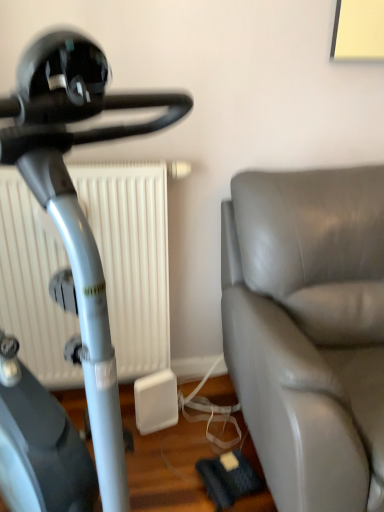
Question: Considering the relative sizes of gray leather couch at right and matte black stationary bicycle at left in the image provided, is gray leather couch at right taller than matte black stationary bicycle at left?

Choices:
 (A) yes
 (B) no

Answer: (B)

Question: Is gray leather couch at right touching matte black stationary bicycle at left?

Choices:
 (A) no
 (B) yes

Answer: (A)

Question: From a real-world perspective, is gray leather couch at right beneath matte black stationary bicycle at left?

Choices:
 (A) yes
 (B) no

Answer: (A)

Question: Can you confirm if gray leather couch at right is smaller than matte black stationary bicycle at left?

Choices:
 (A) no
 (B) yes

Answer: (A)

Question: Can you confirm if gray leather couch at right is bigger than matte black stationary bicycle at left?

Choices:
 (A) yes
 (B) no

Answer: (A)

Question: Can you confirm if gray leather couch at right is shorter than matte black stationary bicycle at left?

Choices:
 (A) yes
 (B) no

Answer: (A)

Question: Is gray leather couch at right at the right side of white matte radiator at center?

Choices:
 (A) no
 (B) yes

Answer: (B)

Question: Is gray leather couch at right closer to camera compared to white matte radiator at center?

Choices:
 (A) no
 (B) yes

Answer: (B)

Question: Can you confirm if gray leather couch at right is shorter than white matte radiator at center?

Choices:
 (A) yes
 (B) no

Answer: (B)

Question: From the image's perspective, is gray leather couch at right under white matte radiator at center?

Choices:
 (A) yes
 (B) no

Answer: (A)

Question: Is gray leather couch at right at the left side of white matte radiator at center?

Choices:
 (A) no
 (B) yes

Answer: (A)

Question: Is there a large distance between gray leather couch at right and white matte radiator at center?

Choices:
 (A) yes
 (B) no

Answer: (B)

Question: Does matte black stationary bicycle at left have a greater height compared to white matte radiator at center?

Choices:
 (A) no
 (B) yes

Answer: (B)